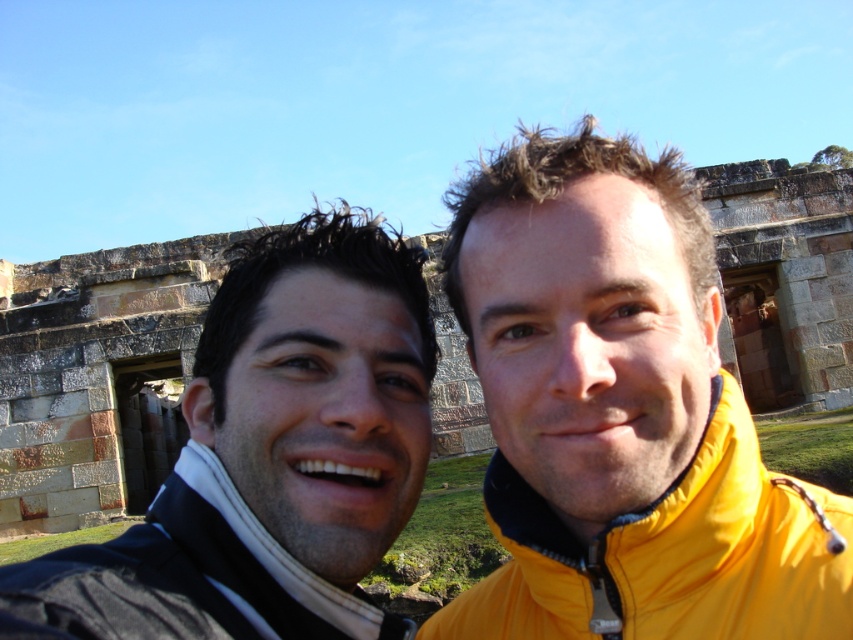
You are a photographer trying to capture a clear shot of both the dark brown hair at center and the dark blue fleece jacket at center. Based on their positions, which object is wider and might require adjusting the camera angle to ensure both fit in the frame?

The dark brown hair at center might be wider than the dark blue fleece jacket at center, so adjusting the camera angle to accommodate its width would help ensure both fit in the frame.

Based on the photo, you are a photographer trying to capture a clear shot of the dark brown hair at center and the dark blue fleece jacket at center. Based on their sizes in the image, which one would appear taller in the photo?

The dark brown hair at center appears taller than the dark blue fleece jacket at center in the photo.

Based on the photo, you are trying to decide which jacket to wear for a walk in the park. You see the yellow fabric jacket at right and the dark blue fleece jacket at center in the image. Which jacket is located to the right of the other?

The yellow fabric jacket at right is positioned on the right side of dark blue fleece jacket at center.